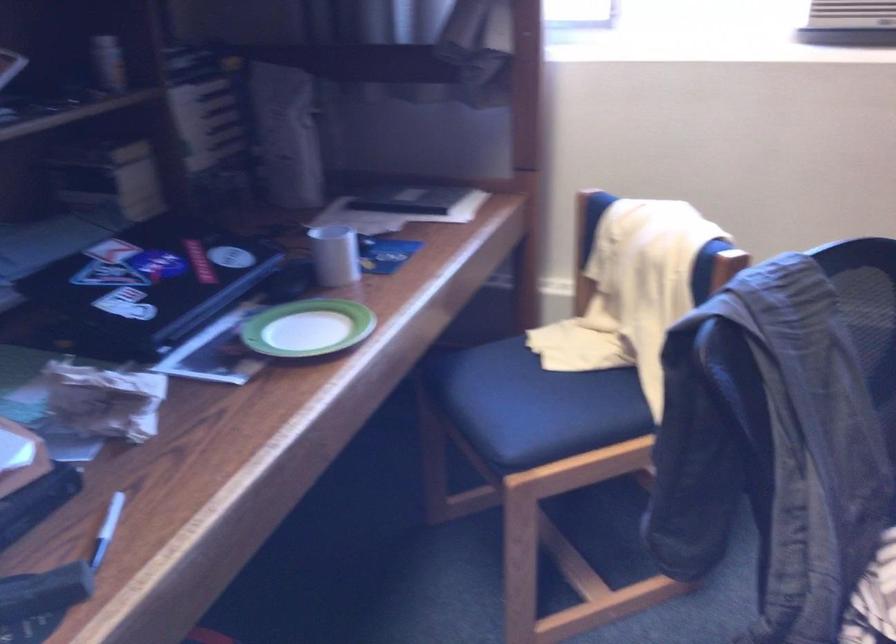
Where is `blue chair sitting surface`? The width and height of the screenshot is (896, 644). blue chair sitting surface is located at coordinates (576, 393).